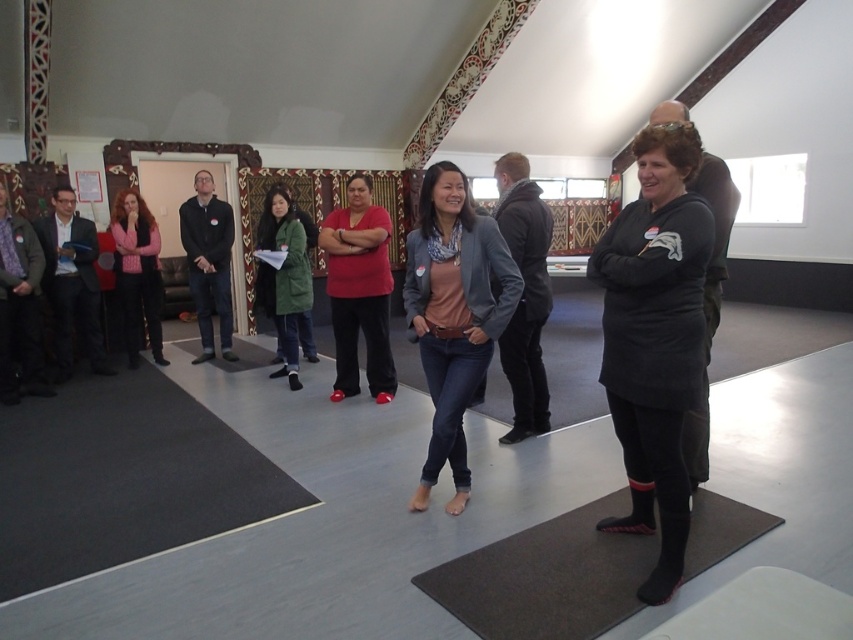
Who is positioned more to the left, matte red shirt at center or dark blue jeans at center?

Positioned to the left is dark blue jeans at center.

Does matte red shirt at center appear on the right side of dark blue jeans at center?

Result: Correct, you'll find matte red shirt at center to the right of dark blue jeans at center.

Which is behind, point (355, 266) or point (212, 339)?

Point (212, 339)

This screenshot has height=640, width=853. In order to click on matte red shirt at center in this screenshot , I will do `click(358, 291)`.

Can you confirm if dark gray hoodie at center is bigger than dark gray sweater at left?

Indeed, dark gray hoodie at center has a larger size compared to dark gray sweater at left.

Is point (508, 177) positioned before point (19, 301)?

Yes, point (508, 177) is in front of point (19, 301).

Locate an element on the screen. Image resolution: width=853 pixels, height=640 pixels. dark gray hoodie at center is located at coordinates (524, 292).

The width and height of the screenshot is (853, 640). I want to click on dark gray hoodie at center, so click(524, 292).

Is matte black suit at left bigger than dark blue jeans at center?

Actually, matte black suit at left might be smaller than dark blue jeans at center.

Does matte black suit at left appear on the right side of dark blue jeans at center?

Incorrect, matte black suit at left is not on the right side of dark blue jeans at center.

Who is more forward, (57, 369) or (207, 257)?

Point (57, 369)

This screenshot has height=640, width=853. Find the location of `matte black suit at left`. matte black suit at left is located at coordinates (71, 282).